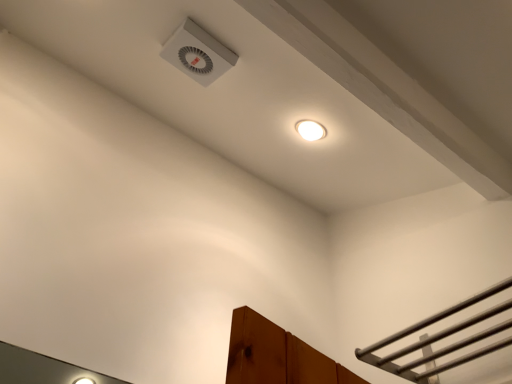
Question: Should I look upward or downward to see white plastic vent at upper center?

Choices:
 (A) down
 (B) up

Answer: (B)